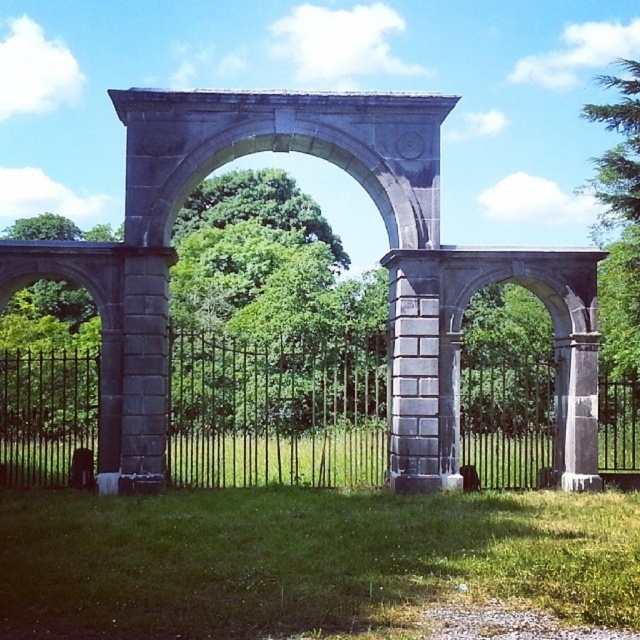
You are standing in front of the grand stone archway and want to walk through the path between the green grass at lower center and the black wrought iron fence at center. Can you pass through sideways without bending down?

The green grass at lower center is narrower than the black wrought iron fence at center, so the path between them is wide enough for you to pass sideways without bending down.

You are a gardener who wants to plant a new flower bed between the green grass at lower center and the black wrought iron fence at center. Considering their heights, which object should you place the flowers closer to?

Since the green grass at lower center is shorter than the black wrought iron fence at center, you should plant the flowers closer to the green grass at lower center to ensure they are visible and not overshadowed by the taller fence.